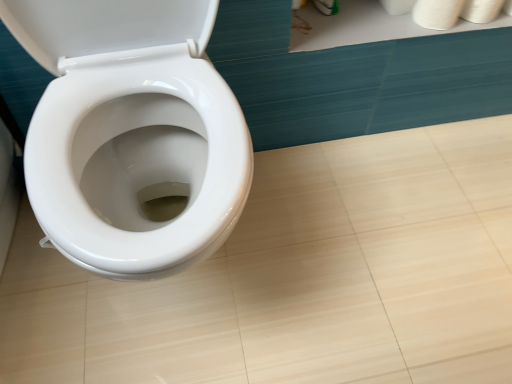
You are a GUI agent. You are given a task and a screenshot of the screen. Output one action in this format:
    pyautogui.click(x=<x>, y=<y>)
    Task: Click on the vacant area that is in front of white matte toilet paper at upper right, the third toilet paper viewed from the right
    
    Given the screenshot: What is the action you would take?
    pyautogui.click(x=393, y=23)